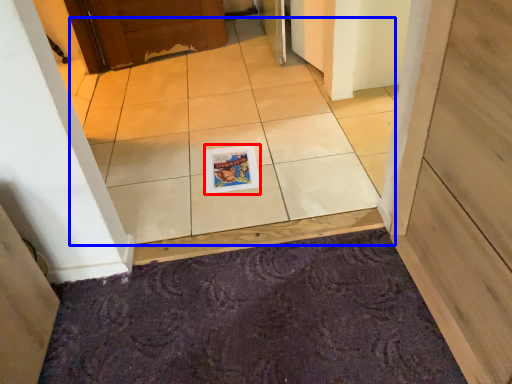
Question: Which point is closer to the camera, magazine (highlighted by a red box) or ceramic tile (highlighted by a blue box)?

Choices:
 (A) magazine
 (B) ceramic tile

Answer: (B)